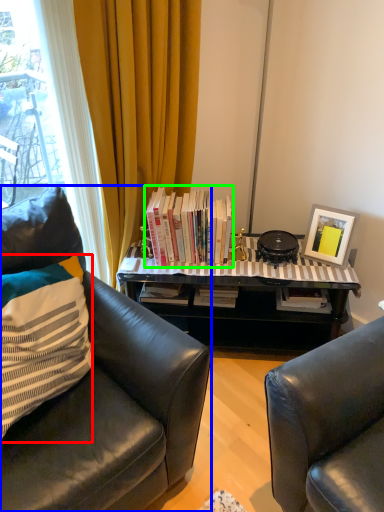
Question: Estimate the real-world distances between objects in this image. Which object is closer to pillow (highlighted by a red box), chair (highlighted by a blue box) or book (highlighted by a green box)?

Choices:
 (A) chair
 (B) book

Answer: (A)